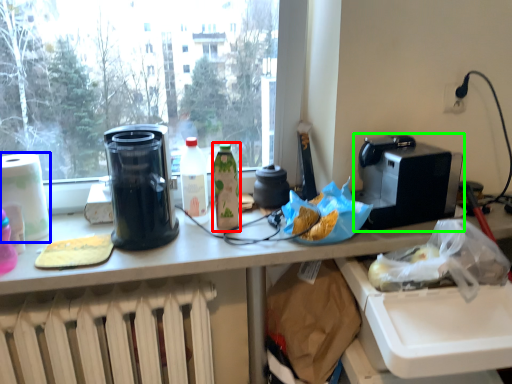
Question: Considering the real-world distances, which object is farthest from bottle (highlighted by a red box)? toilet paper (highlighted by a blue box) or kitchen appliance (highlighted by a green box)?

Choices:
 (A) toilet paper
 (B) kitchen appliance

Answer: (A)